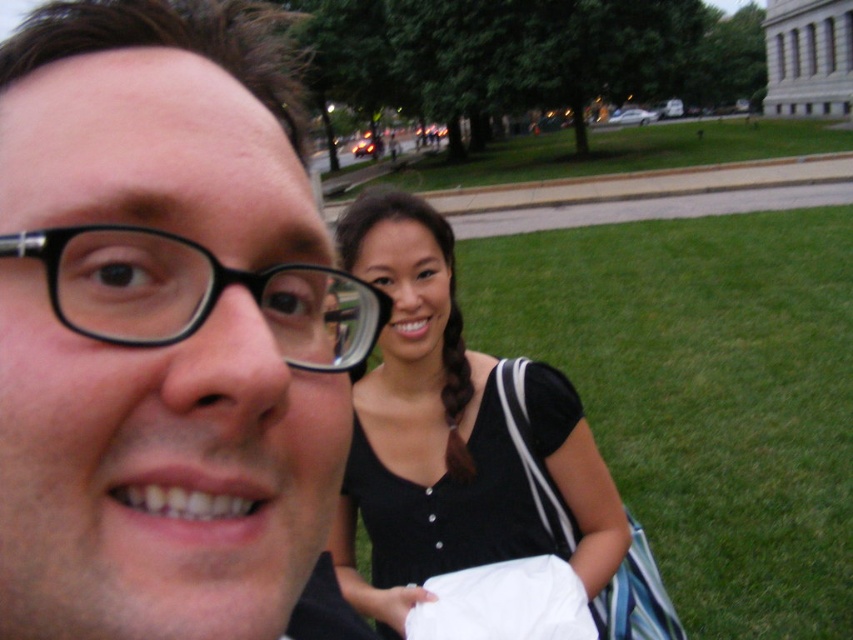
You are planning to place a 100 feet long bench between the green grass at lower right and the green grass at center. Can you fit the bench in the available space between them?

The distance between the green grass at lower right and the green grass at center is 75.80 feet, which is shorter than the 100 feet bench. Therefore, the bench cannot be placed between them.

You are taking a photo of the two people in the scene. The black matte glasses at upper left are important for the composition. Where should you position the glasses in the frame to maintain the current composition?

The black matte glasses at upper left should be positioned at point (165, 342) to maintain the current composition.